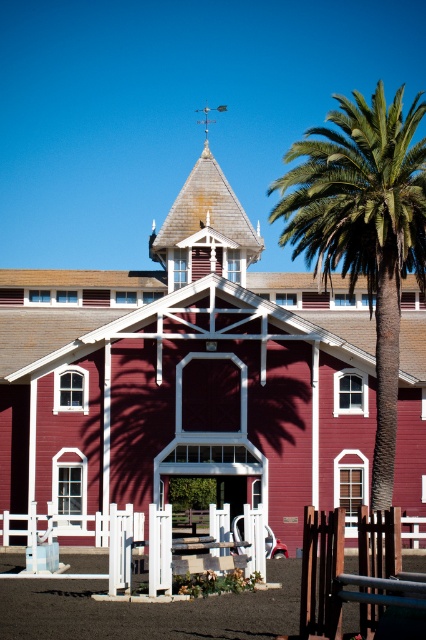
From the picture: Which of these two, matte red barn at center or green leafy palm at right, stands taller?

green leafy palm at right is taller.

Is matte red barn at center smaller than green leafy palm at right?

Correct, matte red barn at center occupies less space than green leafy palm at right.

Does point (109, 278) come in front of point (368, 285)?

No, (109, 278) is further to viewer.

At what (x,y) coordinates should I click in order to perform the action: click on matte red barn at center. Please return your answer as a coordinate pair (x, y). The width and height of the screenshot is (426, 640). Looking at the image, I should click on (187, 376).